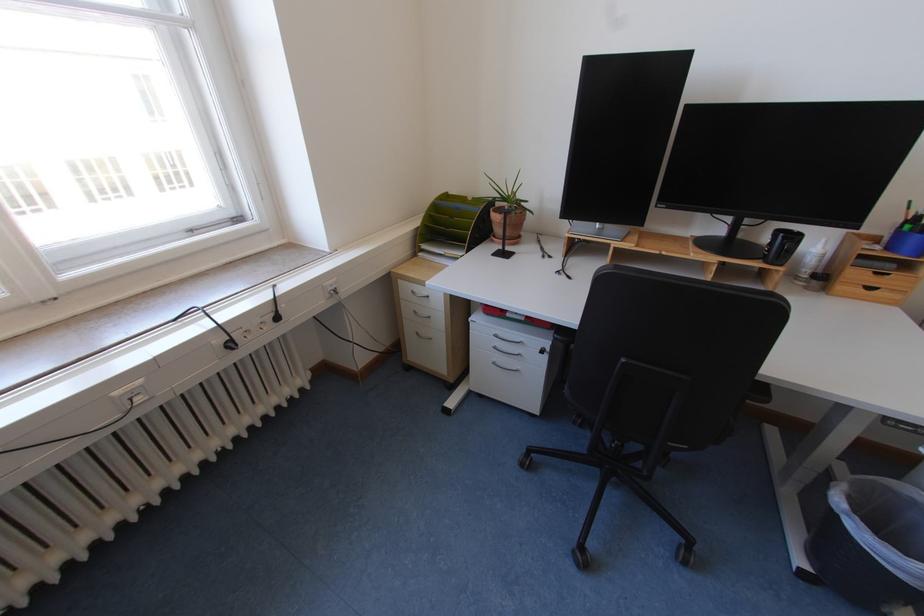
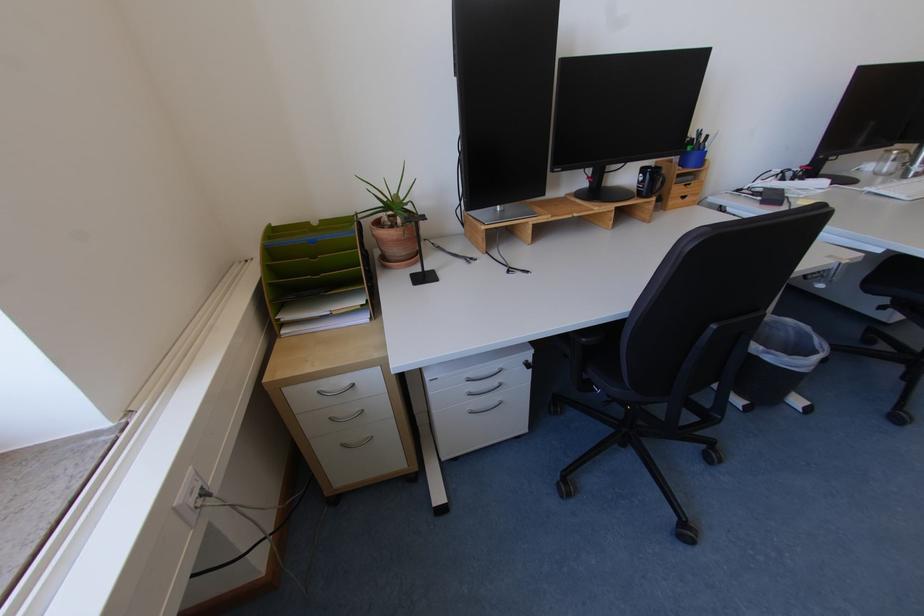
Where in the second image is the point corresponding to pixel 504 334 from the first image?

(475, 378)